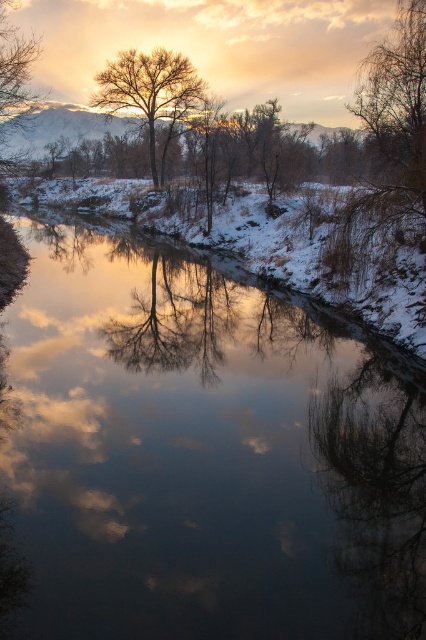
Does point (146, 102) come behind point (19, 38)?

Yes.

Can you confirm if bare branches tree at center is positioned to the right of bare branches at upper left?

Correct, you'll find bare branches tree at center to the right of bare branches at upper left.

The image size is (426, 640). Identify the location of bare branches tree at center. (149, 88).

The width and height of the screenshot is (426, 640). What are the coordinates of `bare branches tree at center` in the screenshot? It's located at 149,88.

Who is positioned more to the right, transparent glass trees at center or bare branches tree at center?

From the viewer's perspective, transparent glass trees at center appears more on the right side.

Is transparent glass trees at center above bare branches tree at center?

No.

Find the location of a particular element. transparent glass trees at center is located at coordinates (196, 317).

Which of these two, smooth water at center or transparent glass trees at center, stands shorter?

smooth water at center is shorter.

Does smooth water at center appear on the right side of transparent glass trees at center?

Correct, you'll find smooth water at center to the right of transparent glass trees at center.

Is point (196, 592) more distant than point (213, 301)?

No, (196, 592) is closer to viewer.

Find the location of `smooth water at center`. smooth water at center is located at coordinates (203, 456).